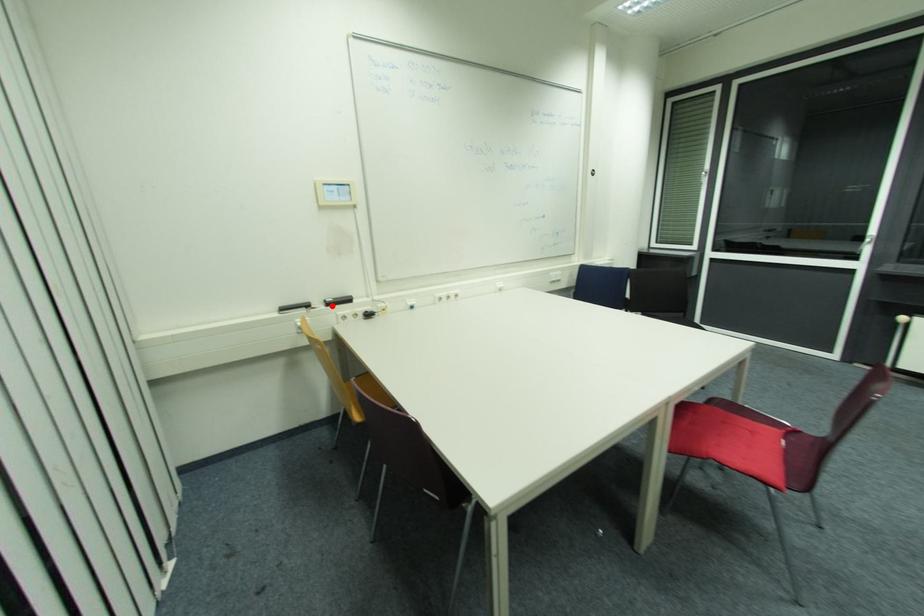
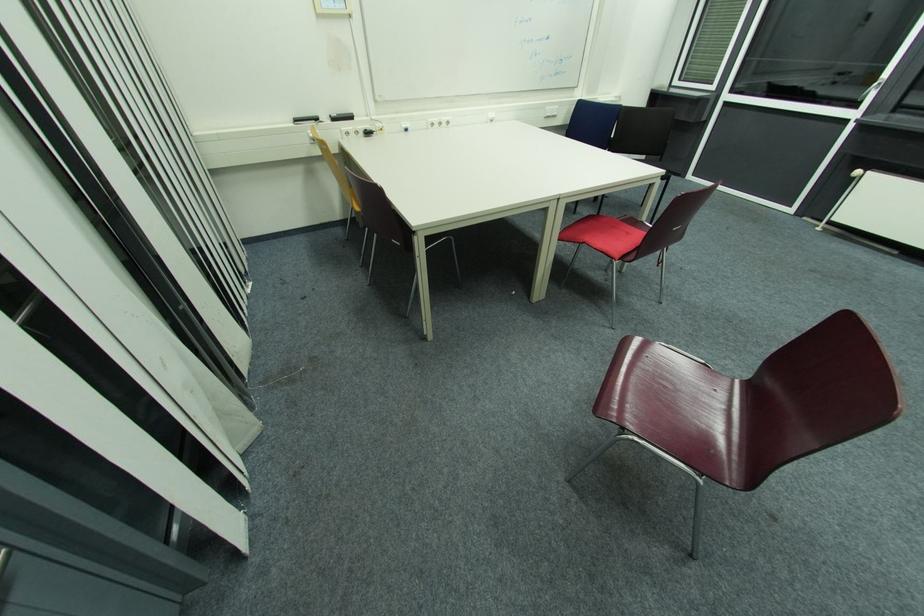
Question: I am providing you with two images of the same scene from different viewpoints. Image1 has a red point marked. In image2, the corresponding 3D location appears at what relative position? Reply with the corresponding letter.

Choices:
 (A) Closer
 (B) Farther

Answer: (A)